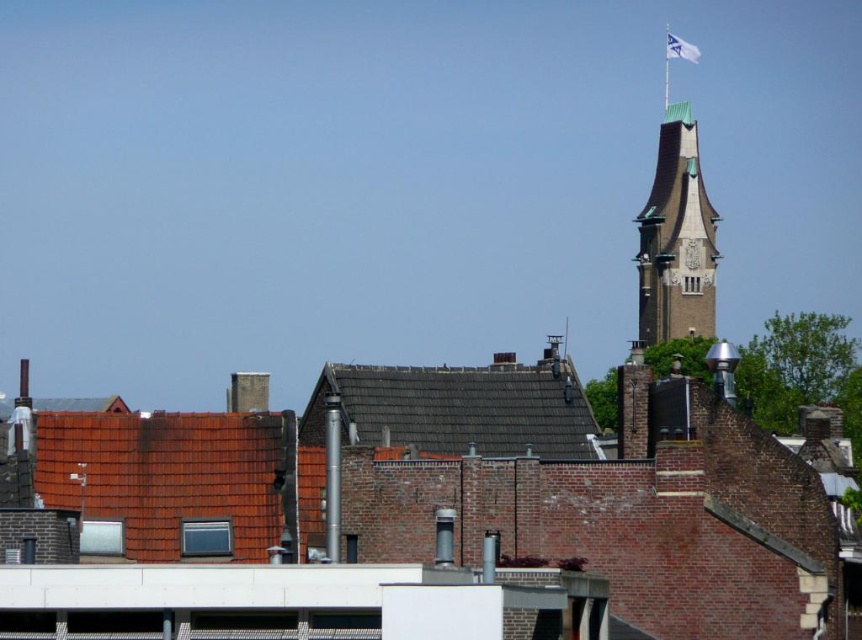
Question: Which point is closer to the camera taking this photo?

Choices:
 (A) (678, 45)
 (B) (473, 392)

Answer: (B)

Question: Can you confirm if brown shingles at center is smaller than white fabric flag at upper right?

Choices:
 (A) yes
 (B) no

Answer: (A)

Question: Is brown stone tower at upper right positioned at the back of white fabric flag at upper right?

Choices:
 (A) no
 (B) yes

Answer: (A)

Question: Which point is closer to the camera?

Choices:
 (A) (690, 160)
 (B) (394, 408)

Answer: (B)

Question: Based on their relative distances, which object is nearer to the brown stone tower at upper right?

Choices:
 (A) white fabric flag at upper right
 (B) brown shingles at center

Answer: (A)

Question: From the image, what is the correct spatial relationship of brown shingles at center in relation to white fabric flag at upper right?

Choices:
 (A) above
 (B) below

Answer: (B)